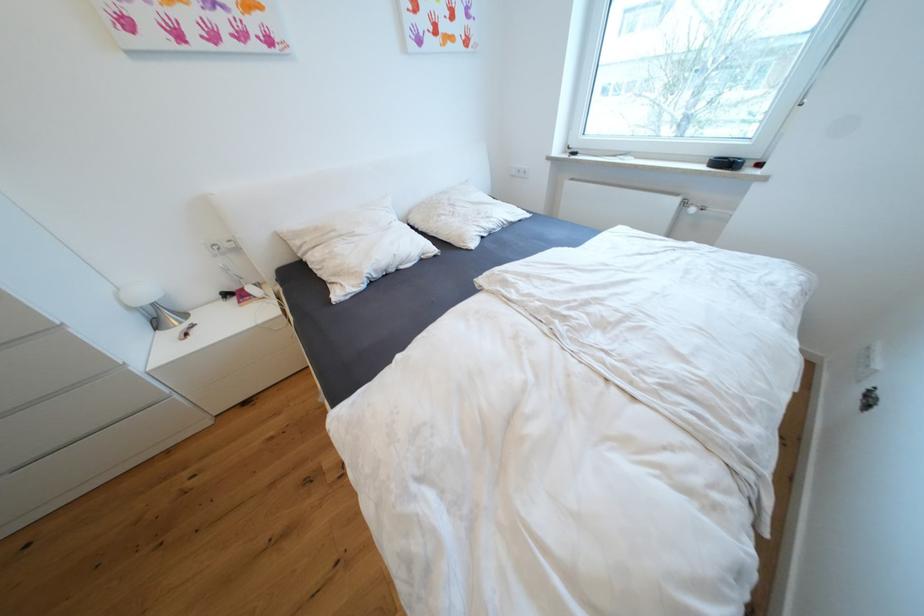
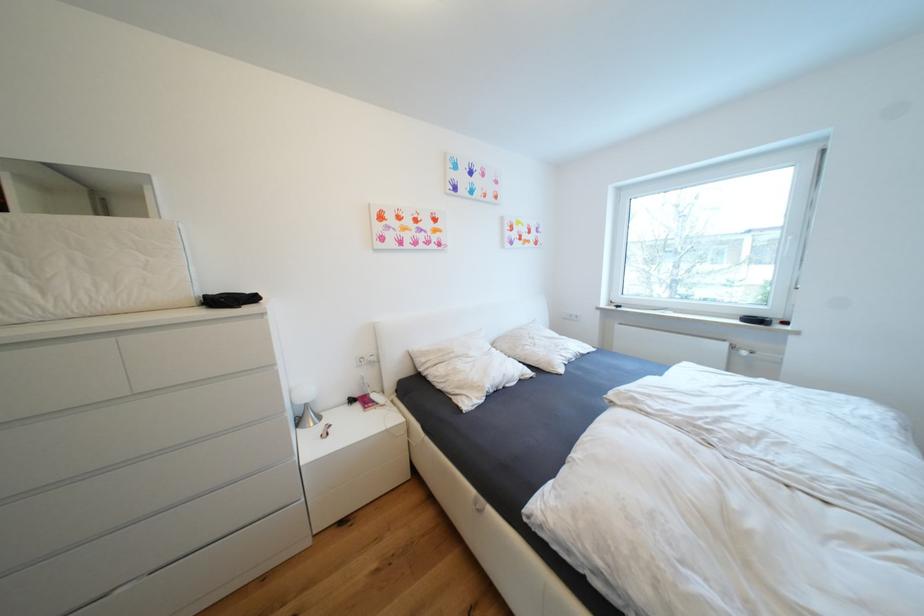
Which direction would the cameraman need to move to produce the second image?

The cameraman moved toward left, backward.